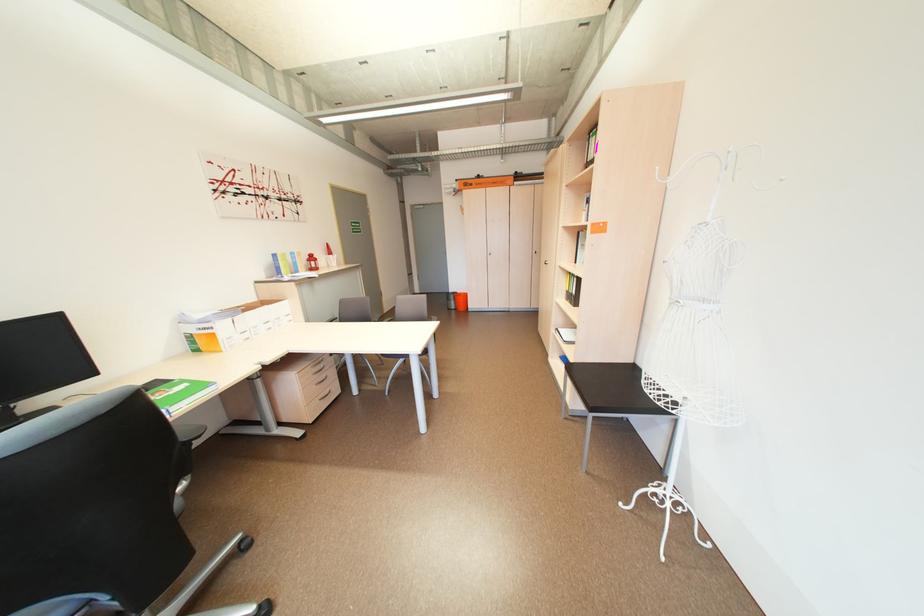
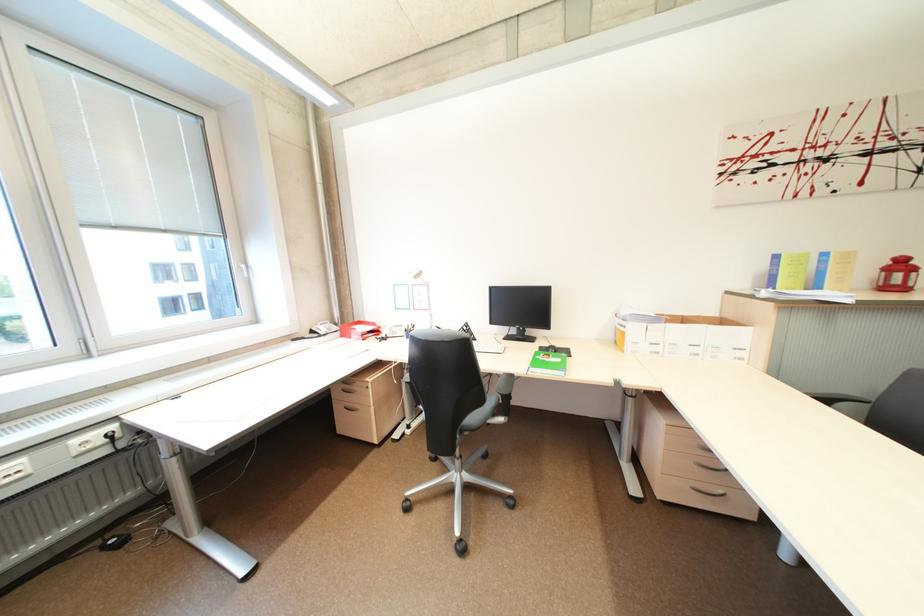
Locate, in the second image, the point that corresponds to point 306,272 in the first image.

(825, 286)